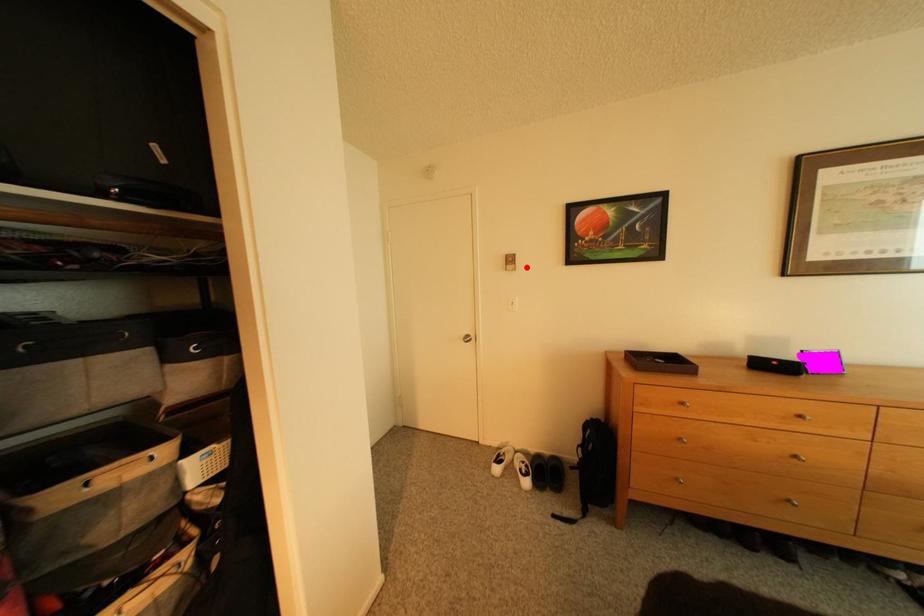
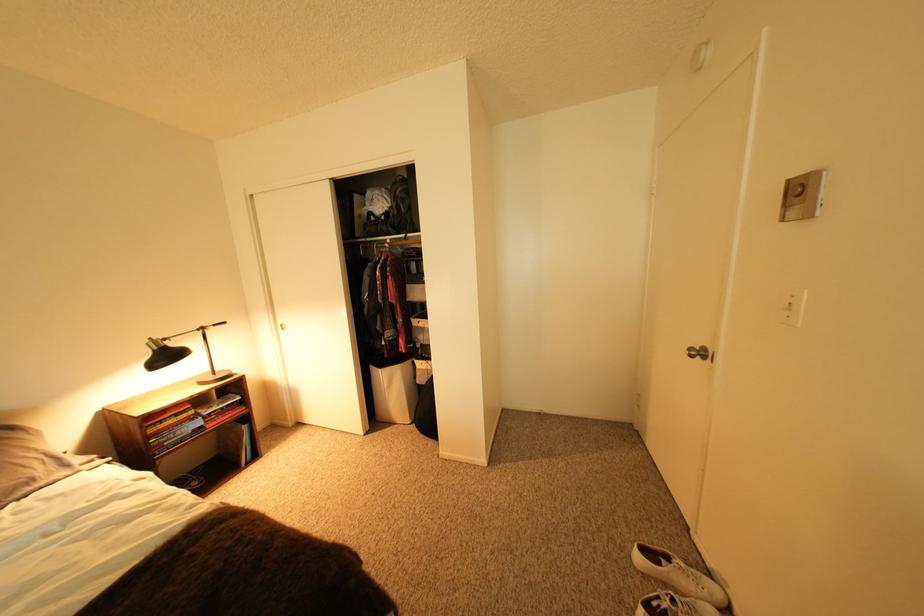
Find the pixel in the second image that matches the highlighted location in the first image.

(816, 207)